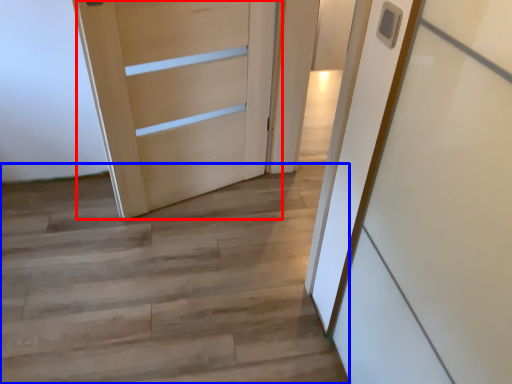
Question: Which object is further to the camera taking this photo, door (highlighted by a red box) or stairwell (highlighted by a blue box)?

Choices:
 (A) door
 (B) stairwell

Answer: (A)